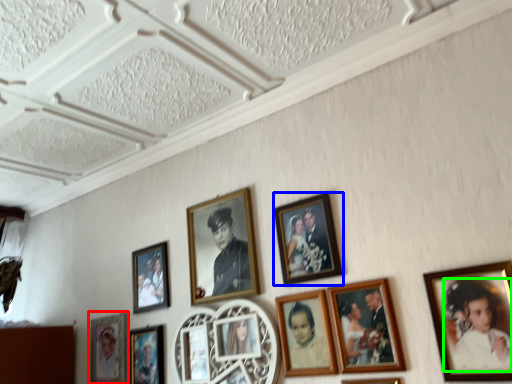
Question: Which object is positioned farthest from picture frame (highlighted by a red box)? Select from picture frame (highlighted by a blue box) and person (highlighted by a green box).

Choices:
 (A) picture frame
 (B) person

Answer: (B)